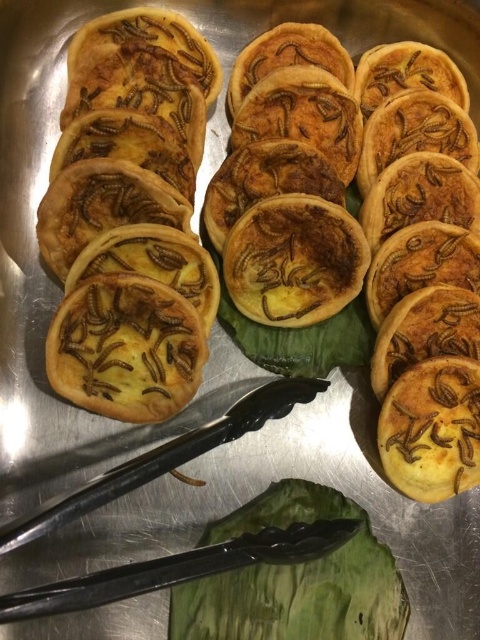
Does green leafy vegetable at lower center have a greater height compared to golden crispy pastry at right?

Incorrect, green leafy vegetable at lower center's height is not larger of golden crispy pastry at right's.

Which of these two, green leafy vegetable at lower center or golden crispy pastry at right, stands shorter?

With less height is green leafy vegetable at lower center.

Is point (369, 637) behind point (403, 484)?

No, it is in front of (403, 484).

Find the location of `green leafy vegetable at lower center`. green leafy vegetable at lower center is located at coordinates (295, 579).

Who is positioned more to the left, golden-brown crispy pastry at left or brown matte cookie at center?

Positioned to the left is brown matte cookie at center.

Is the position of golden-brown crispy pastry at left less distant than that of brown matte cookie at center?

No, it is behind brown matte cookie at center.

What do you see at coordinates (359, 228) in the screenshot? I see `golden-brown crispy pastry at left` at bounding box center [359, 228].

The image size is (480, 640). I want to click on golden-brown crispy pastry at left, so click(359, 228).

Is point (357, 552) closer to camera compared to point (172, 392)?

Yes, point (357, 552) is closer to viewer.

Based on the photo, which of these two, green leafy vegetable at lower center or brown matte cookie at center, stands shorter?

Standing shorter between the two is green leafy vegetable at lower center.

Identify the location of green leafy vegetable at lower center. (295, 579).